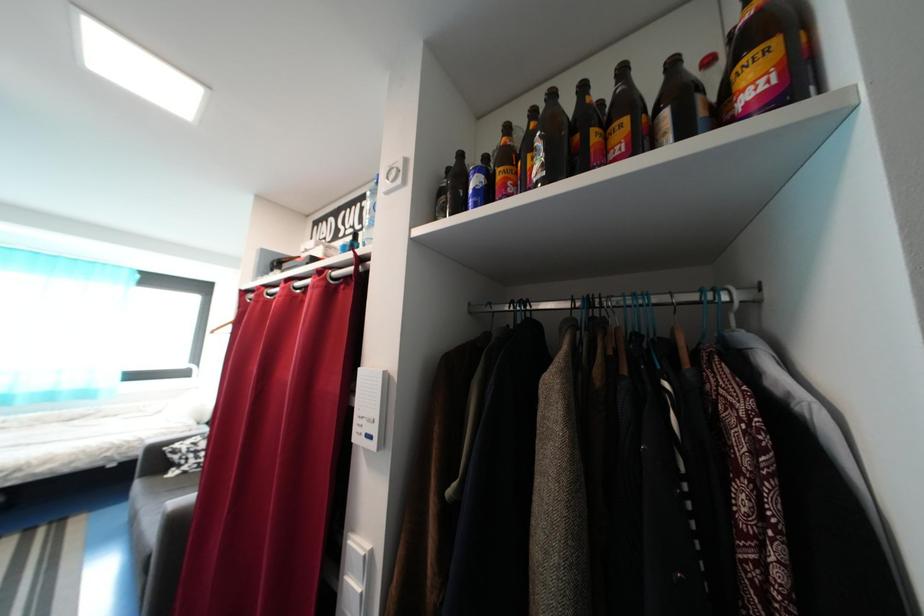
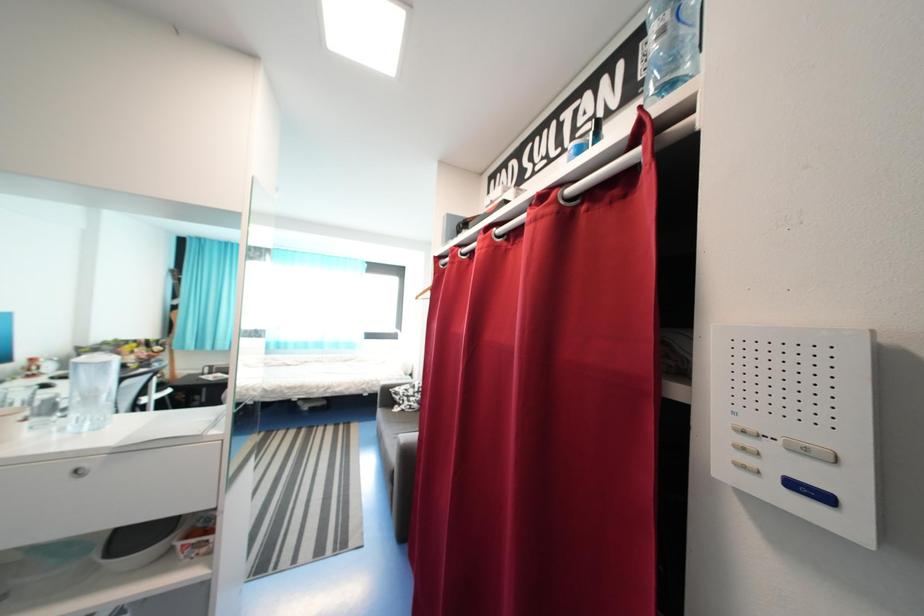
Question: The camera is either moving clockwise (left) or counter-clockwise (right) around the object. The first image is from the beginning of the video and the second image is from the end. Is the camera moving left or right when shooting the video?

Choices:
 (A) Left
 (B) Right

Answer: (B)